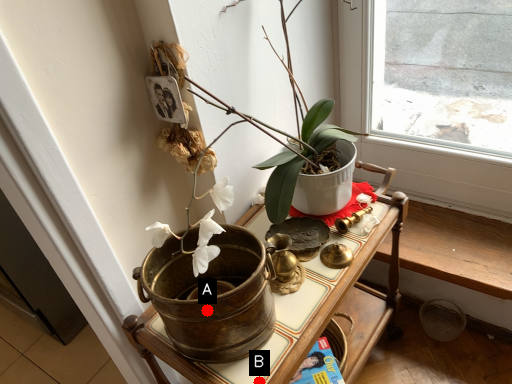
Question: Two points are circled on the image, labeled by A and B beside each circle. Which of the following is the closest to the observer?

Choices:
 (A) A is closer
 (B) B is closer

Answer: (A)